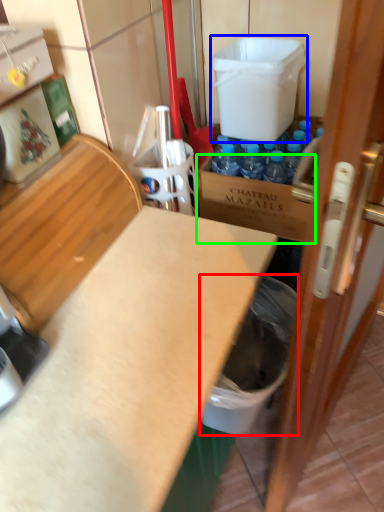
Question: Which is nearer to the garbage (highlighted by a red box)? water cooler (highlighted by a blue box) or cardboard box (highlighted by a green box).

Choices:
 (A) water cooler
 (B) cardboard box

Answer: (B)